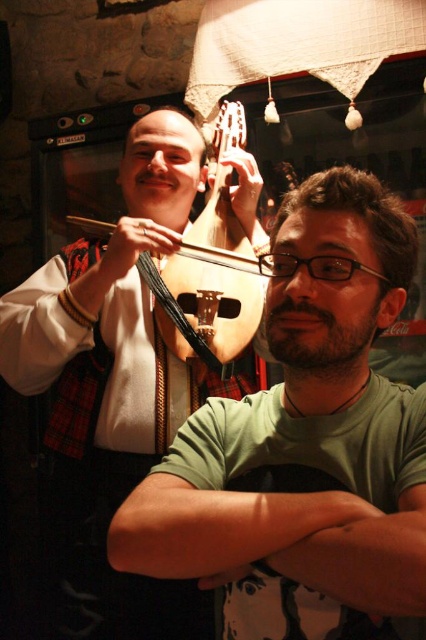
Who is positioned more to the right, green matte shirt at center or wooden cello at upper center?

green matte shirt at center is more to the right.

Can you confirm if green matte shirt at center is bigger than wooden cello at upper center?

Yes.

Is point (284, 372) behind point (244, 170)?

No, (284, 372) is closer to viewer.

The image size is (426, 640). Find the location of `green matte shirt at center`. green matte shirt at center is located at coordinates (304, 436).

Can you confirm if green matte shirt at center is positioned to the right of matte black guitar at left?

Correct, you'll find green matte shirt at center to the right of matte black guitar at left.

Is point (270, 428) positioned before point (92, 525)?

Yes, point (270, 428) is closer to viewer.

In order to click on green matte shirt at center in this screenshot , I will do `click(304, 436)`.

Is matte black guitar at left closer to the viewer compared to wooden cello at upper center?

No, it is not.

Consider the image. Can you confirm if matte black guitar at left is bigger than wooden cello at upper center?

Indeed, matte black guitar at left has a larger size compared to wooden cello at upper center.

Between point (123, 368) and point (160, 157), which one is positioned in front?

Point (123, 368)

The height and width of the screenshot is (640, 426). I want to click on matte black guitar at left, so click(112, 387).